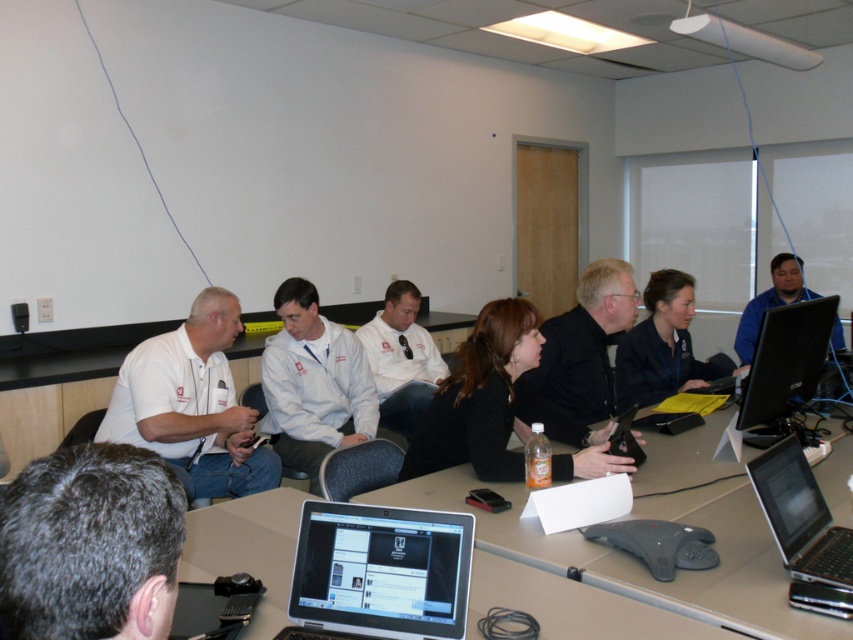
Question: Is silver metallic laptop at center to the right of white matte shirt at left from the viewer's perspective?

Choices:
 (A) yes
 (B) no

Answer: (A)

Question: Does silver metallic laptop at lower right lie behind white matte shirt at center?

Choices:
 (A) yes
 (B) no

Answer: (B)

Question: Which of the following is the farthest from the observer?

Choices:
 (A) (788, 294)
 (B) (206, 296)

Answer: (A)

Question: Is gray hair at lower left to the left of black fabric shirt at center from the viewer's perspective?

Choices:
 (A) no
 (B) yes

Answer: (B)

Question: Which of the following is the farthest from the observer?

Choices:
 (A) (786, 364)
 (B) (254, 628)
 (C) (288, 380)
 (D) (587, 410)

Answer: (C)

Question: Which of these objects is positioned farthest from the black matte jacket at center?

Choices:
 (A) black glossy monitor at right
 (B) white matte shirt at center
 (C) silver metallic laptop at lower right
 (D) gray hair at lower left

Answer: (D)